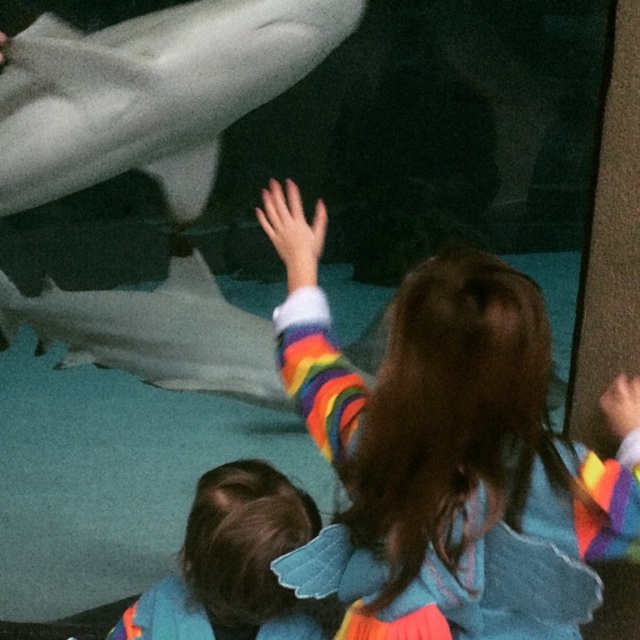
Does white smooth shark at upper left come in front of rainbow striped sweater at lower left?

No.

Which is in front, point (182, 214) or point (195, 627)?

Point (195, 627) is more forward.

The width and height of the screenshot is (640, 640). What do you see at coordinates (150, 93) in the screenshot?
I see `white smooth shark at upper left` at bounding box center [150, 93].

The height and width of the screenshot is (640, 640). What are the coordinates of `white smooth shark at upper left` in the screenshot? It's located at (150, 93).

How far apart are rainbow fabric dress at center and white smooth shark at lower left?

rainbow fabric dress at center and white smooth shark at lower left are 6.57 feet apart.

Between rainbow fabric dress at center and white smooth shark at lower left, which one has less height?

white smooth shark at lower left

Find the location of a particular element. The height and width of the screenshot is (640, 640). rainbow fabric dress at center is located at coordinates (449, 456).

This screenshot has width=640, height=640. Find the location of `rainbow fabric dress at center`. rainbow fabric dress at center is located at coordinates (449, 456).

Can you confirm if rainbow fabric dress at center is taller than white smooth shark at upper left?

Indeed, rainbow fabric dress at center has a greater height compared to white smooth shark at upper left.

Who is positioned more to the left, rainbow fabric dress at center or white smooth shark at upper left?

Positioned to the left is white smooth shark at upper left.

This screenshot has width=640, height=640. What do you see at coordinates (449, 456) in the screenshot?
I see `rainbow fabric dress at center` at bounding box center [449, 456].

The height and width of the screenshot is (640, 640). I want to click on rainbow fabric dress at center, so click(449, 456).